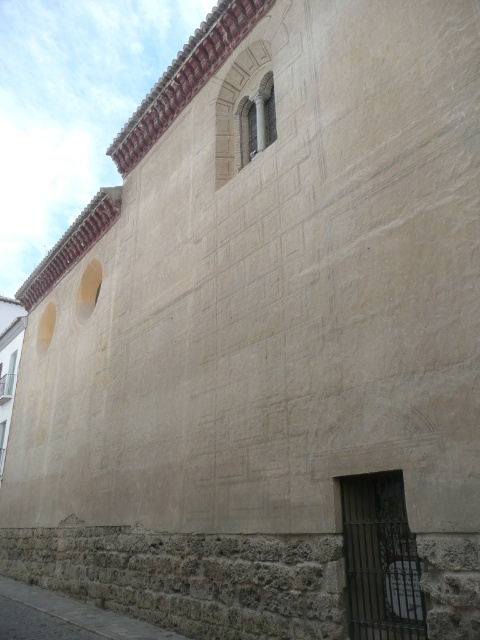
Is dark metal bars at lower right above stone arched window at upper center?

No, dark metal bars at lower right is not above stone arched window at upper center.

Which is above, dark metal bars at lower right or stone arched window at upper center?

stone arched window at upper center is above.

What do you see at coordinates (381, 560) in the screenshot?
I see `dark metal bars at lower right` at bounding box center [381, 560].

At what (x,y) coordinates should I click in order to perform the action: click on dark metal bars at lower right. Please return your answer as a coordinate pair (x, y). The image size is (480, 640). Looking at the image, I should click on (381, 560).